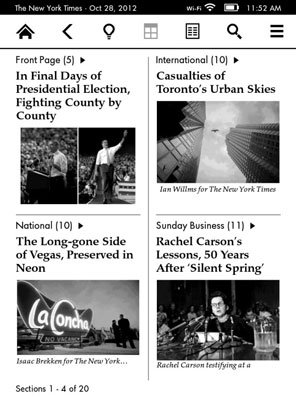
Where is `wifi`? This screenshot has height=400, width=296. wifi is located at coordinates (208, 6).